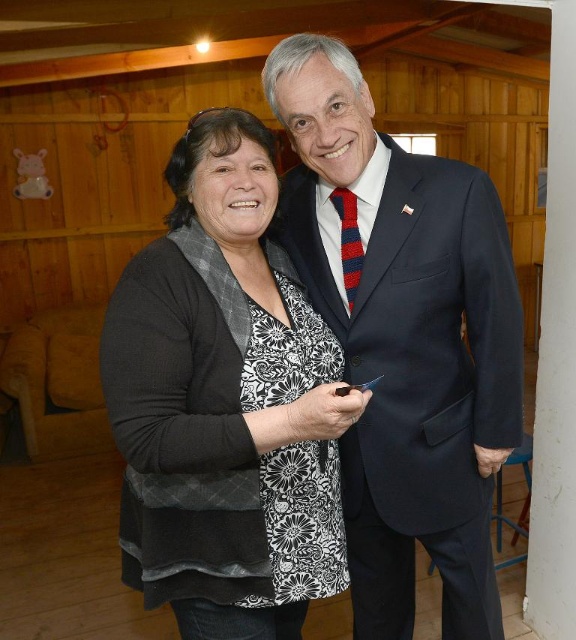
You are standing in the room and want to touch the dark blue suit at center. If you move straight towards it from where you are, will your hand first make contact with the dark blue suit at center before reaching the point at (x=404, y=340)?

The point at (x=404, y=340) is located on the dark blue suit at center, so moving straight towards the suit, your hand would first touch the dark blue suit at center at that point.

You are a photographer trying to capture a group photo of the dark blue suit at center and the red striped tie at center. Since you want to ensure both are visible, which one should you position closer to the camera to avoid being blocked by the other?

The dark blue suit at center is positioned on the right side of red striped tie at center. To avoid blocking, position the red striped tie at center closer to the camera since it is on the left side and might be obscured by the suit on the right.

Based on the photo, you are standing in the room and want to reach the point at coordinates point (259, 486). If your walking speed is 3 feet per second, how many seconds will it take you to reach that point?

The distance between you and the point (259, 486) is 3.96 feet. At a speed of 3 feet per second, it would take approximately 1.32 seconds to reach the point.